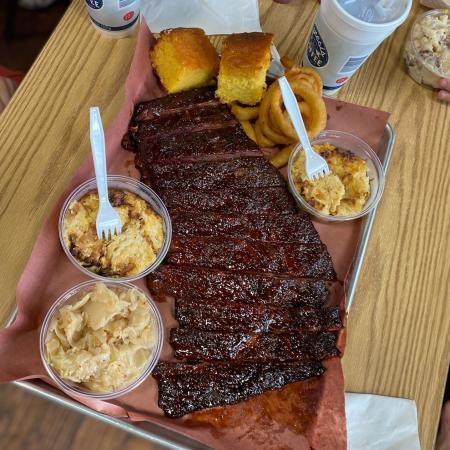
You are a GUI agent. You are given a task and a screenshot of the screen. Output one action in this format:
    pyautogui.click(x=<x>, y=<y>)
    Task: Click on the napkin
    The height and width of the screenshot is (450, 450).
    Given the screenshot: What is the action you would take?
    (x=400, y=431)